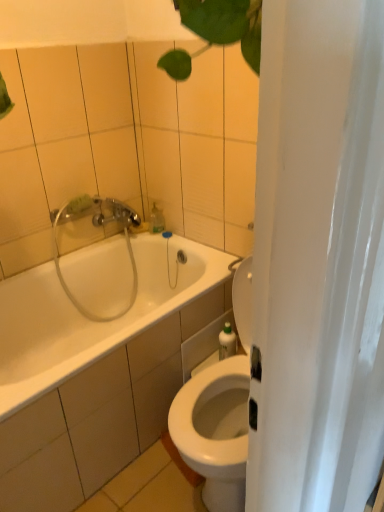
Question: Can we say white glossy bathtub at center lies outside clear plastic showerhead at upper left?

Choices:
 (A) yes
 (B) no

Answer: (A)

Question: Does white glossy bathtub at center appear on the right side of clear plastic showerhead at upper left?

Choices:
 (A) no
 (B) yes

Answer: (B)

Question: Does white glossy bathtub at center have a larger size compared to clear plastic showerhead at upper left?

Choices:
 (A) yes
 (B) no

Answer: (A)

Question: Is white glossy bathtub at center positioned far away from clear plastic showerhead at upper left?

Choices:
 (A) yes
 (B) no

Answer: (B)

Question: Is white glossy bathtub at center smaller than clear plastic showerhead at upper left?

Choices:
 (A) yes
 (B) no

Answer: (B)

Question: Is clear plastic showerhead at upper left a part of white glossy bathtub at center?

Choices:
 (A) no
 (B) yes

Answer: (B)

Question: From a real-world perspective, is white glossy bathtub at center over translucent plastic soap dispenser at upper center?

Choices:
 (A) yes
 (B) no

Answer: (B)

Question: Does white glossy bathtub at center appear on the left side of translucent plastic soap dispenser at upper center?

Choices:
 (A) yes
 (B) no

Answer: (A)

Question: Is translucent plastic soap dispenser at upper center inside white glossy bathtub at center?

Choices:
 (A) yes
 (B) no

Answer: (B)

Question: Is white glossy bathtub at center facing away from translucent plastic soap dispenser at upper center?

Choices:
 (A) no
 (B) yes

Answer: (A)

Question: Is white glossy bathtub at center further to camera compared to translucent plastic soap dispenser at upper center?

Choices:
 (A) no
 (B) yes

Answer: (A)

Question: Is white glossy bathtub at center not inside translucent plastic soap dispenser at upper center?

Choices:
 (A) no
 (B) yes

Answer: (B)

Question: Is green plastic bottle at right looking in the opposite direction of clear plastic showerhead at upper left?

Choices:
 (A) no
 (B) yes

Answer: (A)